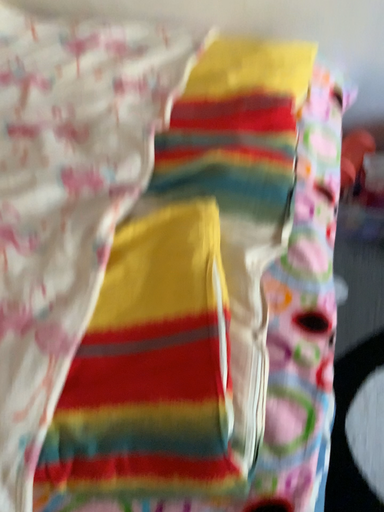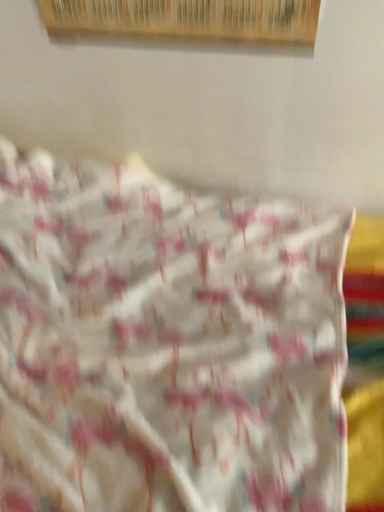
Question: Which way did the camera rotate in the video?

Choices:
 (A) rotated downward
 (B) rotated upward

Answer: (B)